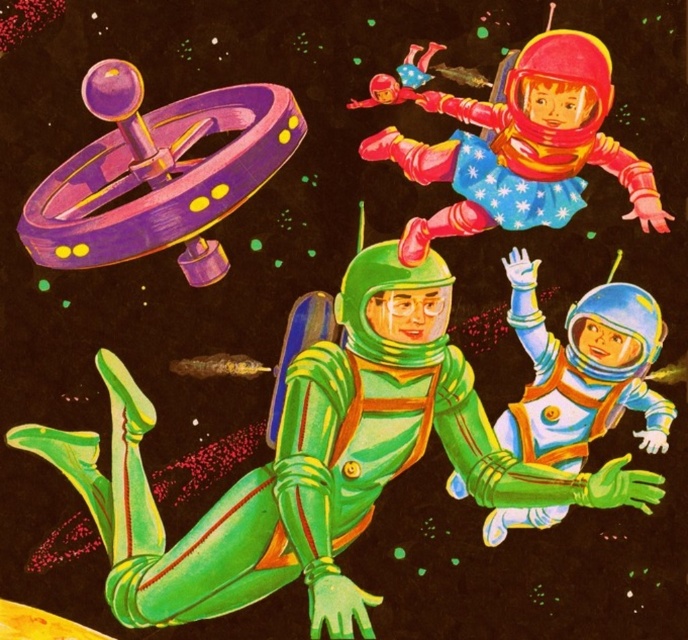
You are an astronaut floating in space and see the purple glossy spinner at upper left. Can you reach it without moving your position? The purple glossy spinner at upper left is at point (158, 173) and you are at point 0.25, 0.25.

Yes, you can reach the purple glossy spinner at upper left because your current position at 0.25, 0.25 is very close to the spinner at (158, 173).

You are an astronaut floating in space and see the purple glossy spinner at upper left and the shiny blue spacesuit at lower right. Which object is located to the left of the other?

The purple glossy spinner at upper left is positioned on the left side of shiny blue spacesuit at lower right.

You are an astronaut in space and need to retrieve an object. You see a purple glossy spinner at upper left and a shiny blue spacesuit at lower right. Which object is closer to you?

The purple glossy spinner at upper left is closer because it is in front of the shiny blue spacesuit at lower right.